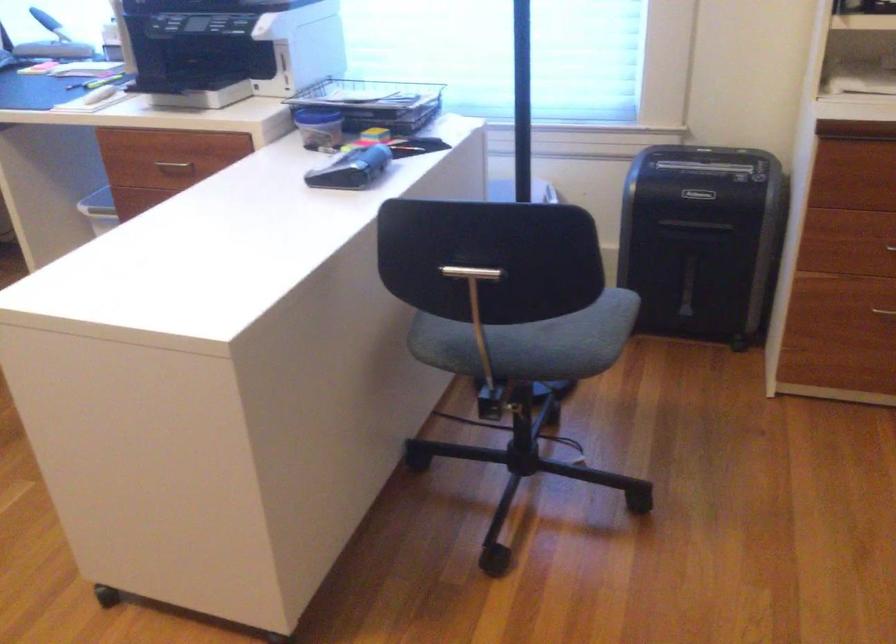
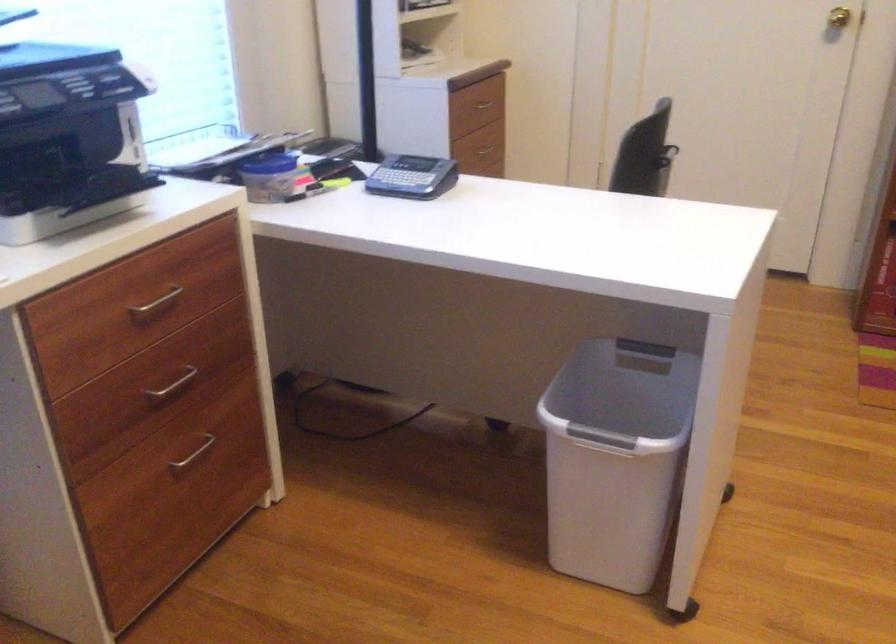
Question: I am providing you with two images of the same scene from different viewpoints. Please identify which objects are invisible in image2.

Choices:
 (A) chair sitting surface
 (B) metal drawer handle
 (C) brass doorknob
 (D) black whiteboard handle

Answer: (A)